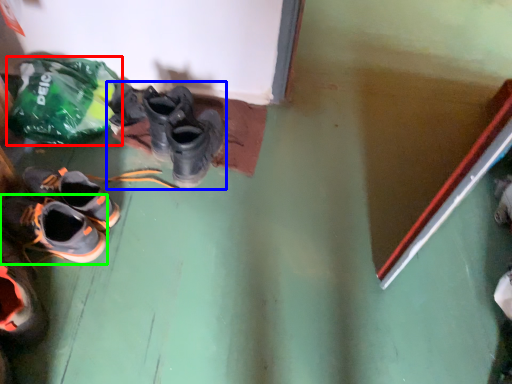
Question: Based on their relative distances, which object is farther from plastic bag (highlighted by a red box)? Choose from footwear (highlighted by a blue box) and shoe (highlighted by a green box).

Choices:
 (A) footwear
 (B) shoe

Answer: (B)